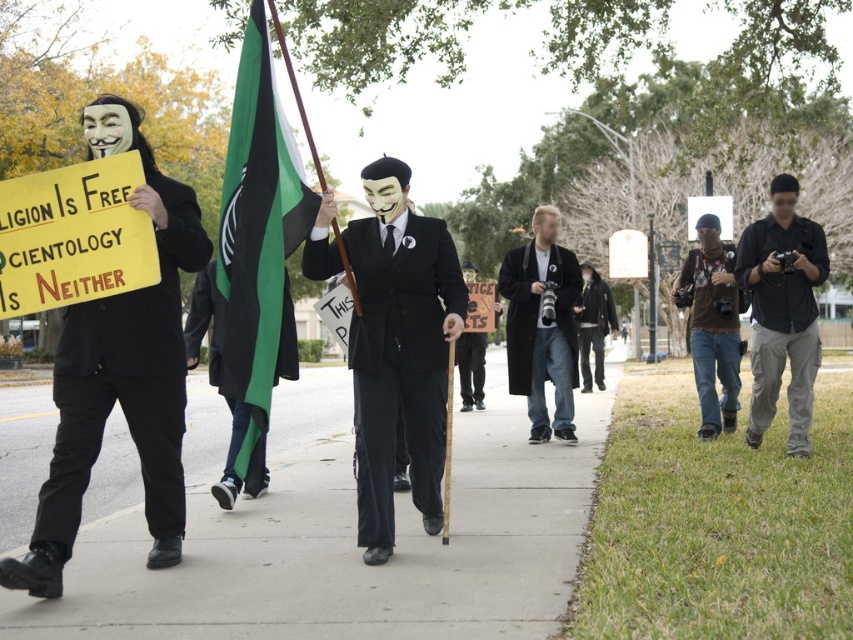
Which of these two, smooth concrete sidewalk at center or wooden signboard at center, stands shorter?

smooth concrete sidewalk at center

Can you confirm if smooth concrete sidewalk at center is positioned above wooden signboard at center?

Actually, smooth concrete sidewalk at center is below wooden signboard at center.

Is point (509, 460) more distant than point (474, 378)?

No, (509, 460) is closer to viewer.

Image resolution: width=853 pixels, height=640 pixels. I want to click on smooth concrete sidewalk at center, so click(350, 548).

Does smooth concrete sidewalk at center have a smaller size compared to green fabric flag at center?

No, smooth concrete sidewalk at center is not smaller than green fabric flag at center.

This screenshot has height=640, width=853. I want to click on smooth concrete sidewalk at center, so click(x=350, y=548).

The width and height of the screenshot is (853, 640). I want to click on smooth concrete sidewalk at center, so click(x=350, y=548).

Which is behind, point (241, 348) or point (698, 262)?

The point (698, 262) is more distant.

In the scene shown: Can you confirm if green fabric flag at center is positioned below brown cotton shirt at center-right?

Correct, green fabric flag at center is located below brown cotton shirt at center-right.

I want to click on green fabric flag at center, so click(x=257, y=252).